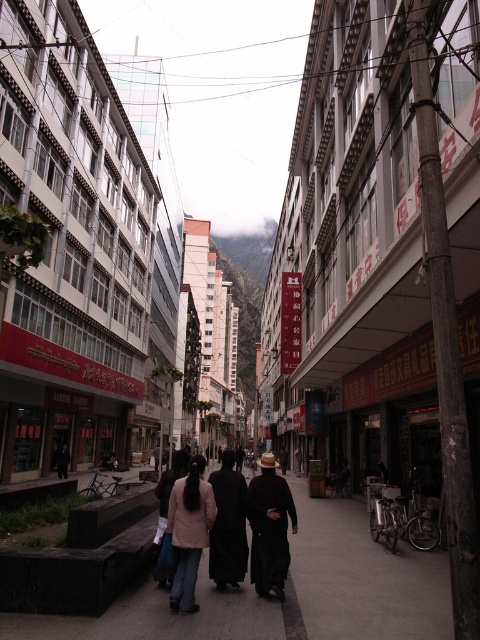
Question: Observing the image, what is the correct spatial positioning of dark gray concrete pavement at center in reference to dark brown leather hat at center?

Choices:
 (A) left
 (B) right

Answer: (B)

Question: Observing the image, what is the correct spatial positioning of dark gray concrete pavement at center in reference to black matte coat at center?

Choices:
 (A) left
 (B) right

Answer: (B)

Question: Which of these objects is positioned farthest from the light pink fabric jacket at center?

Choices:
 (A) black matte coat at center
 (B) dark brown leather hat at center

Answer: (B)

Question: Among these points, which one is nearest to the camera?

Choices:
 (A) (180, 588)
 (B) (400, 566)
 (C) (188, 588)

Answer: (C)

Question: Which of the following is the farthest from the observer?

Choices:
 (A) dark brown leather hat at center
 (B) dark gray concrete pavement at center
 (C) black matte coat at center

Answer: (C)

Question: Does dark gray concrete pavement at center have a lesser width compared to dark brown leather hat at center?

Choices:
 (A) yes
 (B) no

Answer: (B)